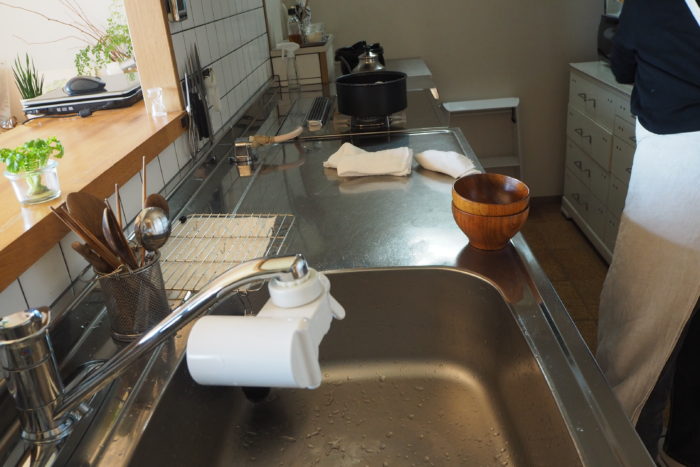
Where is `water filter`? The height and width of the screenshot is (467, 700). water filter is located at coordinates (290, 338).